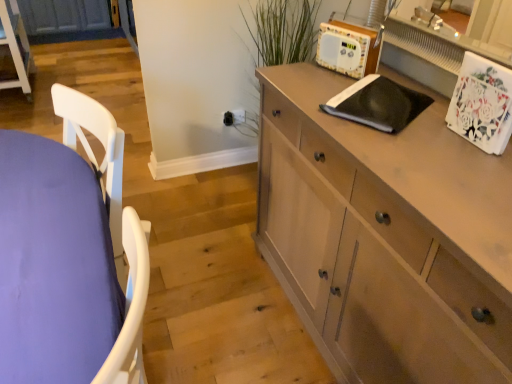
This screenshot has height=384, width=512. Find the location of `blank space situated above light brown wood cabinet at right (from a real-world perspective)`. blank space situated above light brown wood cabinet at right (from a real-world perspective) is located at coordinates (407, 136).